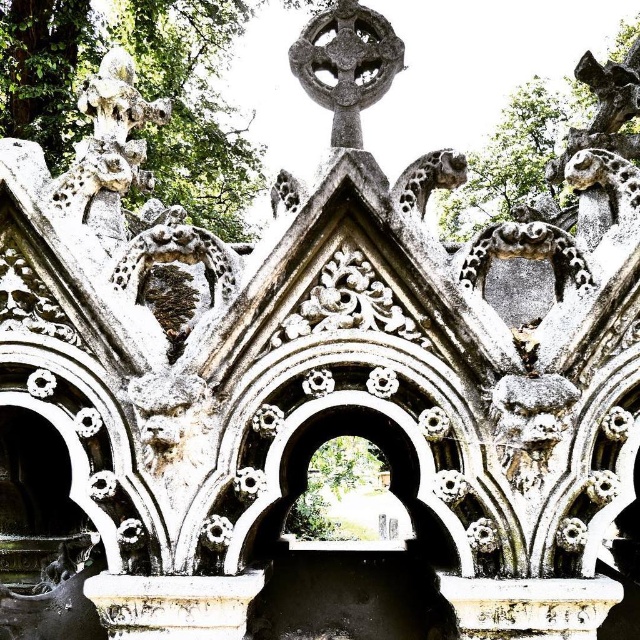
Question: Can you confirm if white stone dragon at upper left is wider than gray stone cross at upper center?

Choices:
 (A) no
 (B) yes

Answer: (A)

Question: Is white stone dragon at upper left thinner than gray stone cross at upper center?

Choices:
 (A) yes
 (B) no

Answer: (A)

Question: Among these points, which one is nearest to the camera?

Choices:
 (A) (115, 221)
 (B) (371, 49)

Answer: (B)

Question: Among these points, which one is nearest to the camera?

Choices:
 (A) (99, 88)
 (B) (356, 52)

Answer: (B)

Question: Can you confirm if white stone dragon at upper left is smaller than gray stone cross at upper center?

Choices:
 (A) no
 (B) yes

Answer: (A)